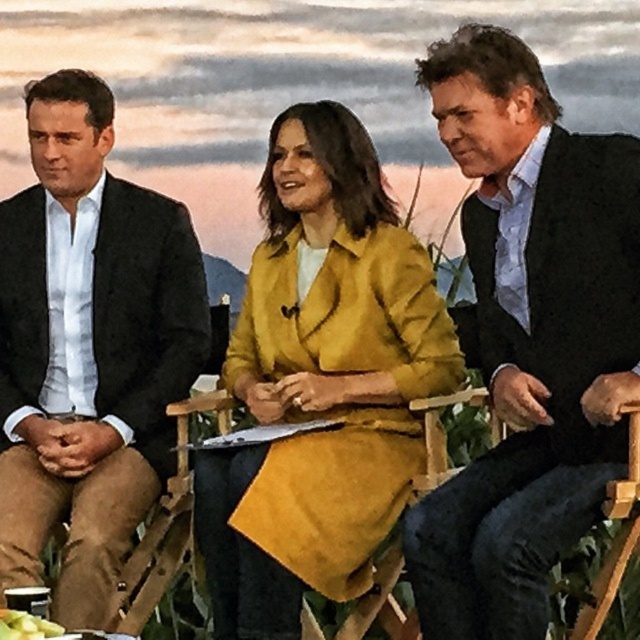
Question: Observing the image, what is the correct spatial positioning of matte black suit at center in reference to matte yellow coat at center?

Choices:
 (A) below
 (B) above

Answer: (B)

Question: Which object is positioned closest to the matte black suit at left?

Choices:
 (A) matte black suit at center
 (B) matte yellow coat at center

Answer: (B)

Question: Which is farther from the matte black suit at center?

Choices:
 (A) matte black suit at left
 (B) matte yellow coat at center

Answer: (A)

Question: Considering the relative positions of matte black suit at center and matte black suit at left in the image provided, where is matte black suit at center located with respect to matte black suit at left?

Choices:
 (A) right
 (B) left

Answer: (A)

Question: Considering the relative positions of matte black suit at center and matte yellow coat at center in the image provided, where is matte black suit at center located with respect to matte yellow coat at center?

Choices:
 (A) left
 (B) right

Answer: (B)

Question: Which point appears closest to the camera in this image?

Choices:
 (A) (493, 170)
 (B) (44, 353)
 (C) (426, 310)

Answer: (A)